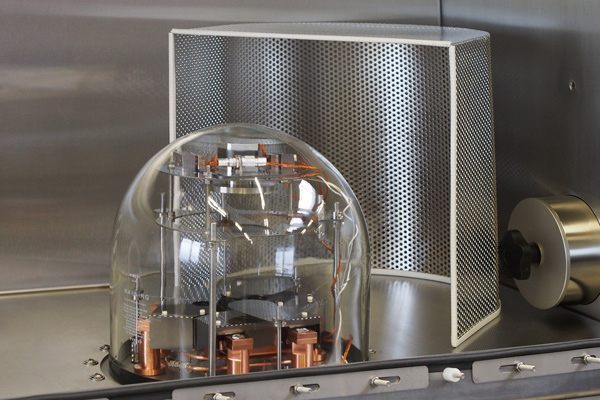
The width and height of the screenshot is (600, 400). In order to click on bell jar in this screenshot , I will do `click(250, 283)`.